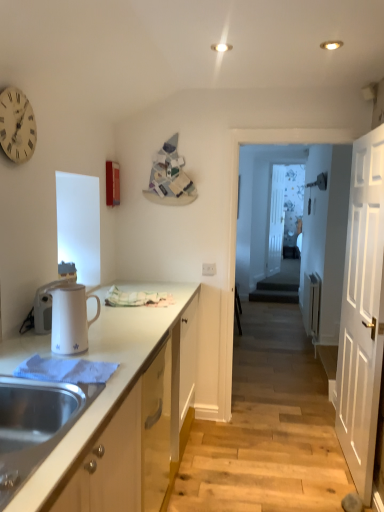
Question: Considering the positions of white glossy cabinet at lower left and transparent glass door at center, arranged as the 1th glass door when viewed from the front, in the image, is white glossy cabinet at lower left taller or shorter than transparent glass door at center, arranged as the 1th glass door when viewed from the front,?

Choices:
 (A) tall
 (B) short

Answer: (B)

Question: Does point (21, 337) appear closer or farther from the camera than point (283, 192)?

Choices:
 (A) farther
 (B) closer

Answer: (B)

Question: Which of these objects is positioned farthest from the white glossy electric kettle at left, which is the first appliance in front-to-back order?

Choices:
 (A) transparent glass door at center, arranged as the 1th glass door when viewed from the front
 (B) white wooden door at right
 (C) white glossy electric kettle at left, the second appliance in the front-to-back sequence
 (D) white wooden clock at upper left
 (E) transparent glass door at center, the 2th glass door viewed from the front

Answer: (A)

Question: Which object is positioned closest to the white glossy cabinet at lower left?

Choices:
 (A) white glossy electric kettle at left, which ranks as the first appliance in right-to-left order
 (B) white wooden clock at upper left
 (C) transparent glass door at center, the 2th glass door viewed from the front
 (D) white glossy electric kettle at left, which is counted as the first appliance, starting from the back
 (E) stainless steel sink at lower left

Answer: (A)